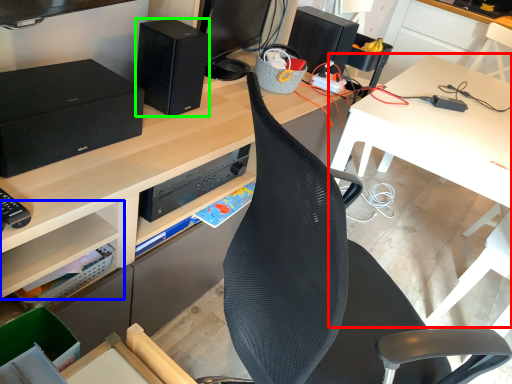
Question: Which is nearer to the table (highlighted by a red box)? shelf (highlighted by a blue box) or speaker (highlighted by a green box).

Choices:
 (A) shelf
 (B) speaker

Answer: (B)